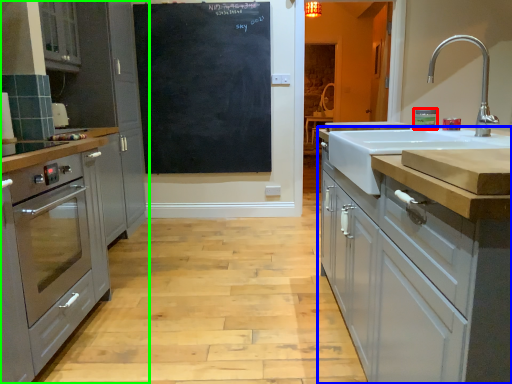
Question: Based on their relative distances, which object is farther from appliance (highlighted by a red box)? Choose from cabinetry (highlighted by a blue box) and cabinetry (highlighted by a green box).

Choices:
 (A) cabinetry
 (B) cabinetry

Answer: (B)